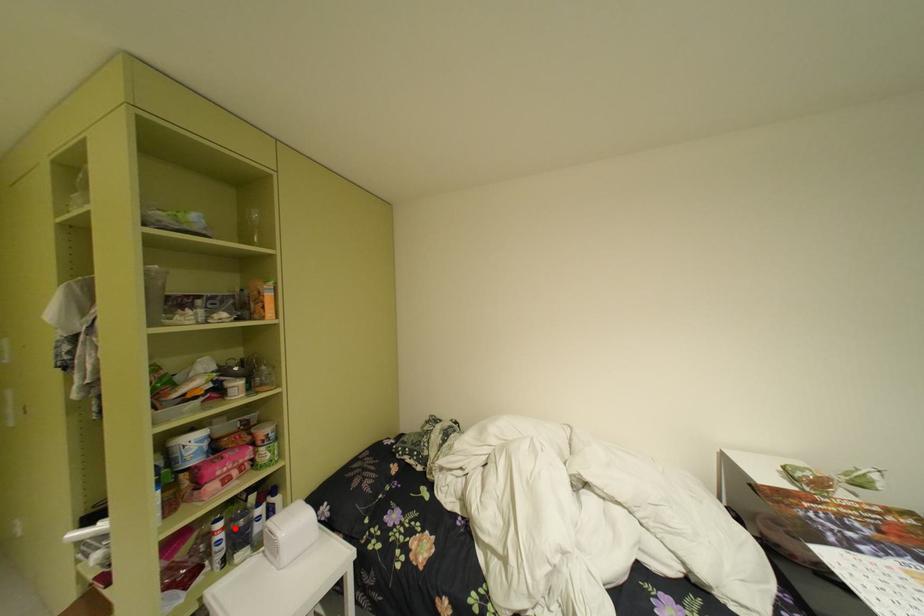
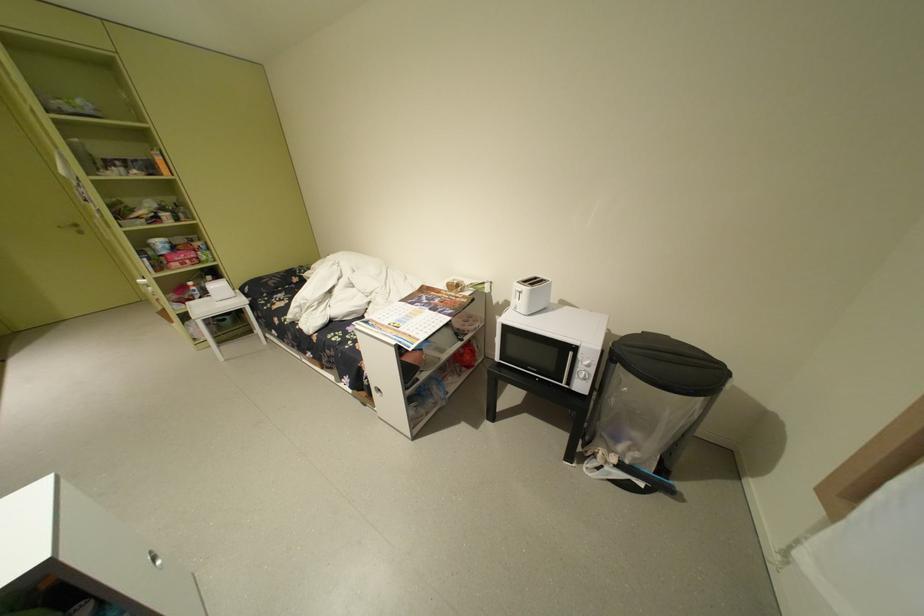
Question: I am providing you with two images of the same scene from different viewpoints. A red point is marked on the first image. At the location where the point appears in image 1, is it still visible in image 2?

Choices:
 (A) Yes
 (B) No

Answer: (A)